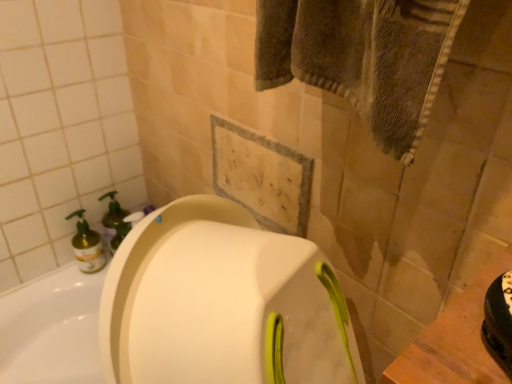
Identify the location of translucent yellow bottle at left. This screenshot has height=384, width=512. (87, 245).

What is the approximate width of translucent yellow bottle at left?

The width of translucent yellow bottle at left is 3.21 inches.

Describe the element at coordinates (87, 245) in the screenshot. The height and width of the screenshot is (384, 512). I see `translucent yellow bottle at left` at that location.

Describe the element at coordinates (114, 221) in the screenshot. This screenshot has width=512, height=384. I see `translucent plastic soap dispenser at left` at that location.

Image resolution: width=512 pixels, height=384 pixels. Identify the location of translucent plastic soap dispenser at left. 114,221.

Measure the distance between point (114, 232) and camera.

The depth of point (114, 232) is 1.25 meters.

Where is `translucent yellow bottle at left`? The width and height of the screenshot is (512, 384). translucent yellow bottle at left is located at coordinates (87, 245).

Between translucent yellow bottle at left and translucent plastic soap dispenser at left, which one appears on the right side from the viewer's perspective?

From the viewer's perspective, translucent plastic soap dispenser at left appears more on the right side.

Who is more distant, translucent yellow bottle at left or translucent plastic soap dispenser at left?

translucent plastic soap dispenser at left is further from the camera.

Which is in front, point (90, 256) or point (122, 209)?

The point (90, 256) is more forward.

From the image's perspective, is translucent yellow bottle at left on top of translucent plastic soap dispenser at left?

Incorrect, from the image's perspective, translucent yellow bottle at left is lower than translucent plastic soap dispenser at left.

Based on the photo, from a real-world perspective, who is located higher, translucent yellow bottle at left or translucent plastic soap dispenser at left?

From a 3D spatial view, translucent plastic soap dispenser at left is above.

Is translucent yellow bottle at left wider than translucent plastic soap dispenser at left?

Yes, translucent yellow bottle at left is wider than translucent plastic soap dispenser at left.

Can you confirm if translucent yellow bottle at left is shorter than translucent plastic soap dispenser at left?

Yes.

From the picture: Does translucent yellow bottle at left have a smaller size compared to translucent plastic soap dispenser at left?

Yes.

Is translucent plastic soap dispenser at left completely or partially inside translucent yellow bottle at left?

That's incorrect, translucent plastic soap dispenser at left is not inside translucent yellow bottle at left.

Are translucent yellow bottle at left and translucent plastic soap dispenser at left located far from each other?

They are positioned close to each other.

Is translucent yellow bottle at left facing towards translucent plastic soap dispenser at left?

No, translucent yellow bottle at left is not aimed at translucent plastic soap dispenser at left.

From the picture: Can you tell me how much translucent yellow bottle at left and translucent plastic soap dispenser at left differ in facing direction?

6.33 degrees.

Could you measure the distance between translucent yellow bottle at left and translucent plastic soap dispenser at left?

6.37 centimeters.

I want to click on soap dispenser on the right side of translucent yellow bottle at left, so click(114, 221).

Considering the positions of objects translucent plastic soap dispenser at left and translucent yellow bottle at left in the image provided, who is more to the right, translucent plastic soap dispenser at left or translucent yellow bottle at left?

translucent plastic soap dispenser at left.

Is translucent plastic soap dispenser at left positioned behind translucent yellow bottle at left?

Yes, translucent plastic soap dispenser at left is further from the viewer.

Between point (124, 229) and point (84, 222), which one is positioned behind?

The point (124, 229) is behind.

From the image's perspective, which one is positioned lower, translucent plastic soap dispenser at left or translucent yellow bottle at left?

translucent yellow bottle at left, from the image's perspective.

From a real-world perspective, which object stands above the other?

translucent plastic soap dispenser at left, from a real-world perspective.

Considering the sizes of translucent plastic soap dispenser at left and translucent yellow bottle at left in the image, is translucent plastic soap dispenser at left wider or thinner than translucent yellow bottle at left?

Clearly, translucent plastic soap dispenser at left has less width compared to translucent yellow bottle at left.

Is translucent plastic soap dispenser at left taller than translucent yellow bottle at left?

Yes, translucent plastic soap dispenser at left is taller than translucent yellow bottle at left.

Considering the relative sizes of translucent plastic soap dispenser at left and translucent yellow bottle at left in the image provided, is translucent plastic soap dispenser at left smaller than translucent yellow bottle at left?

No, translucent plastic soap dispenser at left is not smaller than translucent yellow bottle at left.

Is translucent plastic soap dispenser at left situated inside translucent yellow bottle at left or outside?

translucent plastic soap dispenser at left is located beyond the bounds of translucent yellow bottle at left.

Is translucent plastic soap dispenser at left not near translucent yellow bottle at left?

No, translucent plastic soap dispenser at left is in close proximity to translucent yellow bottle at left.

Is translucent yellow bottle at left at the back of translucent plastic soap dispenser at left?

That's right, translucent plastic soap dispenser at left is facing away from translucent yellow bottle at left.

Image resolution: width=512 pixels, height=384 pixels. In order to click on soap dispenser behind the translucent yellow bottle at left in this screenshot , I will do `click(114, 221)`.

What are the coordinates of `soap dispenser that is behind the translucent yellow bottle at left` in the screenshot? It's located at (114, 221).

There is a translucent yellow bottle at left. At what (x,y) coordinates should I click in order to perform the action: click on soap dispenser above it (from a real-world perspective). Please return your answer as a coordinate pair (x, y). This screenshot has height=384, width=512. Looking at the image, I should click on (114, 221).